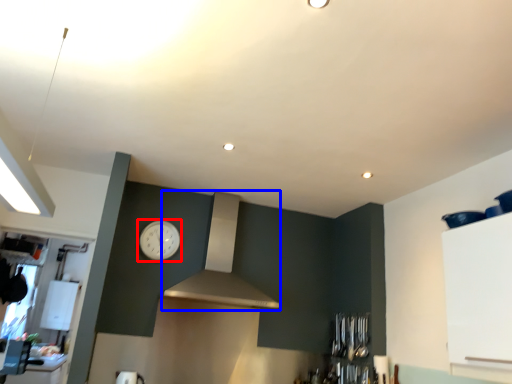
Question: Which object is closer to the camera taking this photo, clock (highlighted by a red box) or vent (highlighted by a blue box)?

Choices:
 (A) clock
 (B) vent

Answer: (B)